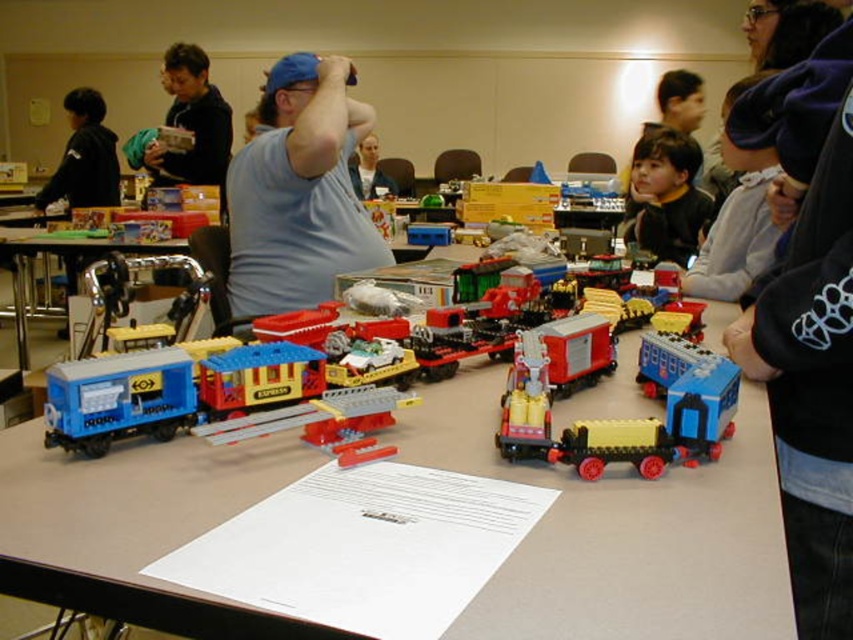
You are a photographer standing at the back of the room. You need to take a photo of both the black jacket at left and the matte blue shirt at center. Which object should you focus on first if you want to capture both in the same frame without moving the camera?

You should focus on the black jacket at left first because it is taller than the matte blue shirt at center, allowing you to adjust the camera settings to accommodate its height while still capturing the shorter matte blue shirt at center in the same frame.

You are standing in front of the table where the LEGO trains are displayed. You see two points marked on the table surface, one at coordinate point (51, 388) and another at point (697, 102). Which point is closer to you?

Point (51, 388) is closer to the camera than point (697, 102), so the point at (51, 388) is closer to you.